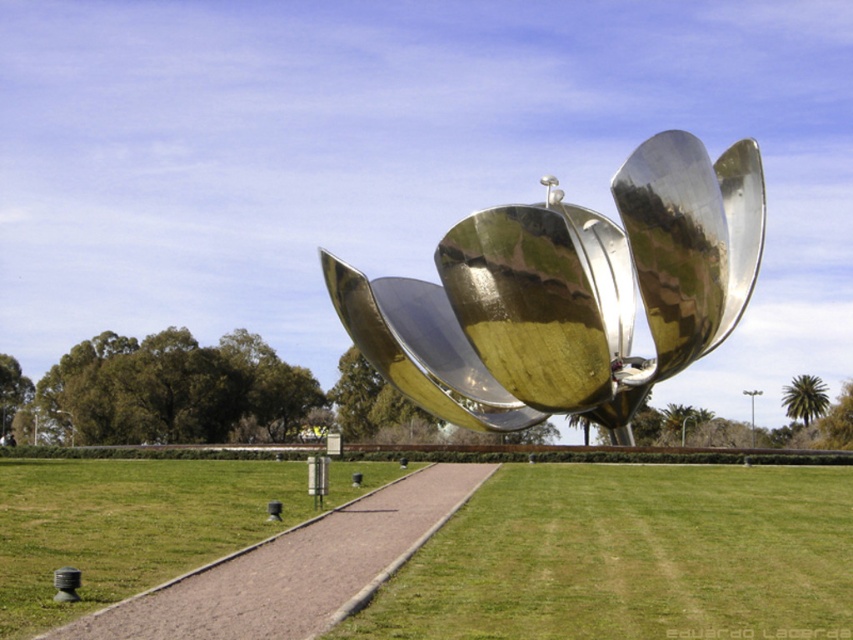
In the scene shown: You are standing at the entrance of the park and see the large metallic sculpture. If you walk straight towards the sculpture along the pathway, what will be the first thing you encounter at the point marked by coordinates point (630, 557)?

The point (630, 557) corresponds to green grass at center, so the first thing encountered would be the green grass at center.

You are a photographer planning to capture the shiny metallic flower at center and the green grass at center in a single shot. Based on their sizes in the scene, which one will appear bigger in your photo?

The shiny metallic flower at center will appear bigger in the photo because it has a larger size compared to the green grass at center.

Looking at this image, you are standing at the starting point of the pathway leading to the metallic sculpture. You see two points marked on the pathway. One is labeled as point (367, 301) and the other as point (262, 544). If you are facing the sculpture, which point is closer to you?

Point (262, 544) is closer to you since it is in front of point (367, 301) when facing the sculpture.